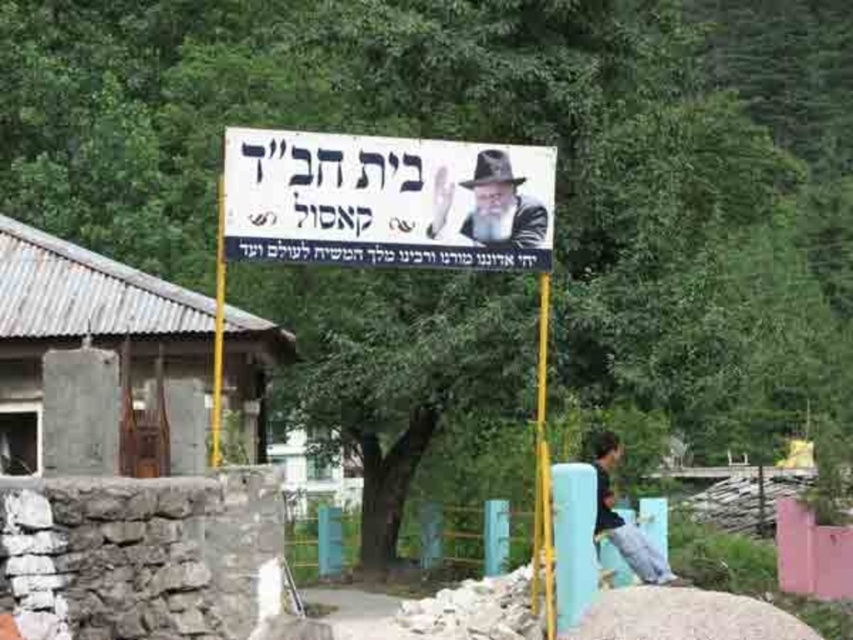
At what (x,y) coordinates should I click in order to perform the action: click on white paper sign at center. Please return your answer as a coordinate pair (x, y). The image size is (853, 640). Looking at the image, I should click on (387, 200).

Between white paper sign at center and yellow metallic pole at center, which one is positioned higher?

Positioned higher is white paper sign at center.

The image size is (853, 640). In order to click on white paper sign at center in this screenshot , I will do `click(387, 200)`.

In the scene shown: Does light blue jeans at lower right appear on the left side of yellow plastic pole at center?

Incorrect, light blue jeans at lower right is not on the left side of yellow plastic pole at center.

Is light blue jeans at lower right bigger than yellow plastic pole at center?

No.

Is point (637, 545) farther from camera compared to point (216, 273)?

No, it is not.

Find the location of a particular element. light blue jeans at lower right is located at coordinates (624, 518).

Is rusty metal hut at left closer to camera compared to white paper sign at center?

Yes, rusty metal hut at left is in front of white paper sign at center.

In the scene shown: Is rusty metal hut at left bigger than white paper sign at center?

Correct, rusty metal hut at left is larger in size than white paper sign at center.

The image size is (853, 640). Describe the element at coordinates (100, 358) in the screenshot. I see `rusty metal hut at left` at that location.

Identify the location of rusty metal hut at left. Image resolution: width=853 pixels, height=640 pixels. (100, 358).